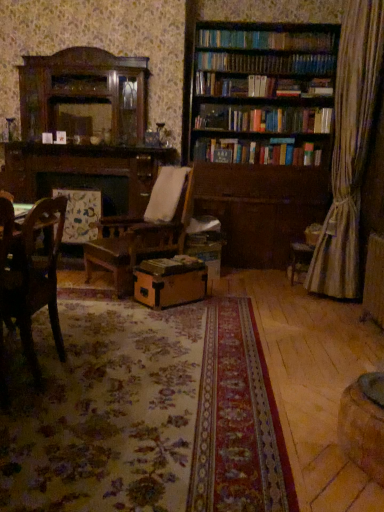
Locate an element on the screen. The height and width of the screenshot is (512, 384). vacant space in front of wooden chair at left is located at coordinates (40, 414).